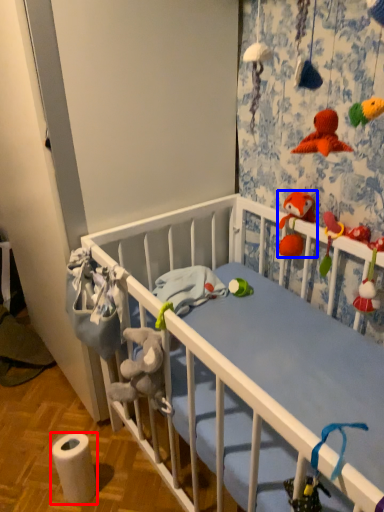
Question: Among these objects, which one is farthest to the camera, toilet paper (highlighted by a red box) or toy (highlighted by a blue box)?

Choices:
 (A) toilet paper
 (B) toy

Answer: (B)